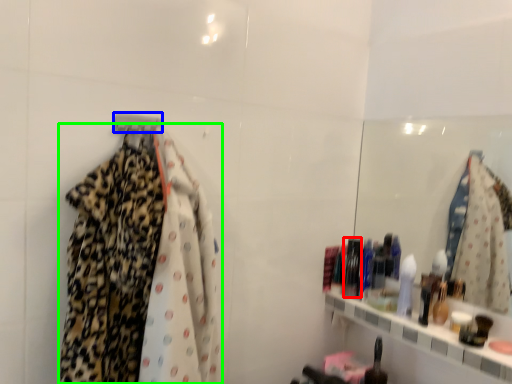
Question: Which object is positioned farthest from toiletry (highlighted by a red box)? Select from hanger (highlighted by a blue box) and fancy dress (highlighted by a green box).

Choices:
 (A) hanger
 (B) fancy dress

Answer: (A)